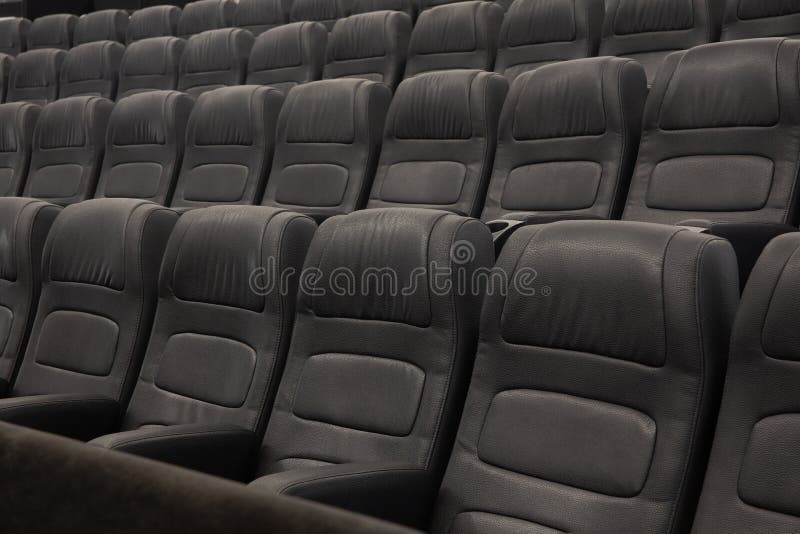
You are a GUI agent. You are given a task and a screenshot of the screen. Output one action in this format:
    pyautogui.click(x=<x>, y=<y>)
    Task: Click on the chairs in lowest visible row
    
    Given the screenshot: What is the action you would take?
    pyautogui.click(x=746, y=427), pyautogui.click(x=601, y=412), pyautogui.click(x=378, y=375), pyautogui.click(x=222, y=358), pyautogui.click(x=37, y=335), pyautogui.click(x=17, y=317)